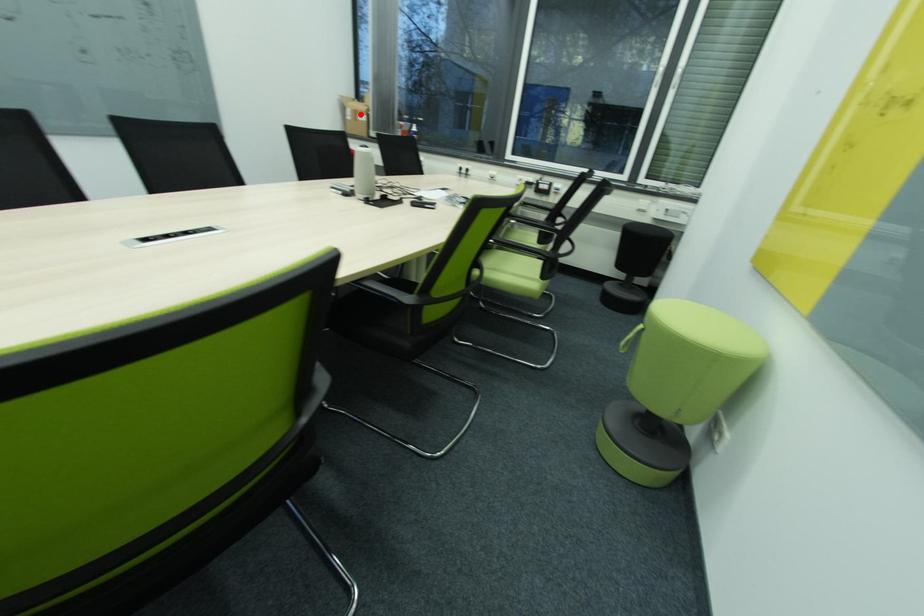
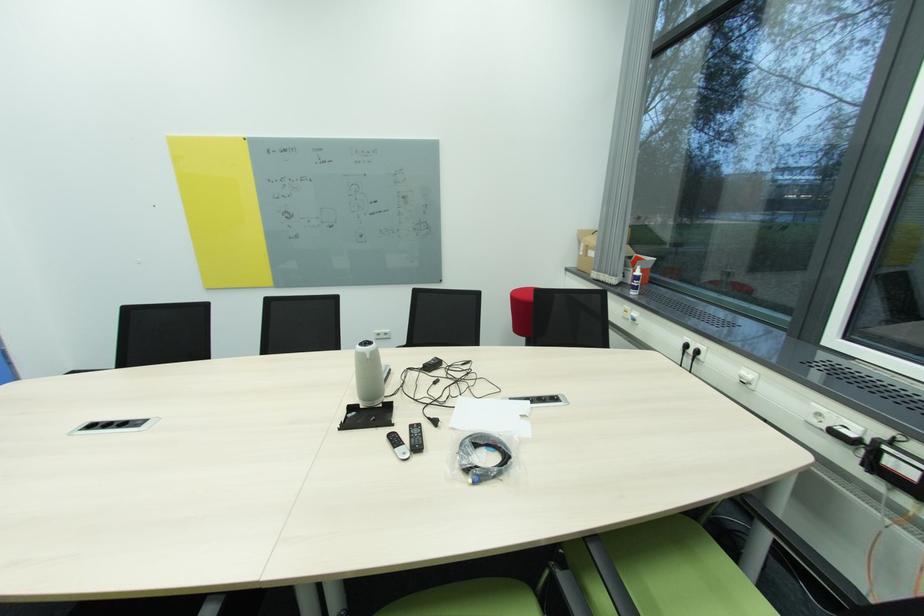
In the second image, find the point that corresponds to the highlighted location in the first image.

(591, 249)